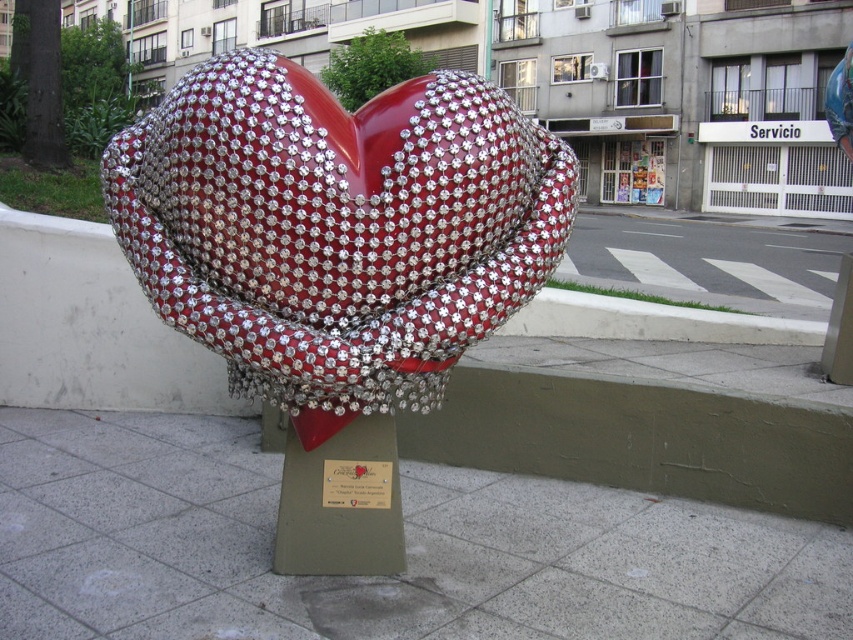
You are an art student analyzing the sculpture. You notice both the shiny metallic heart at center and the metallic plaque at center. Which object is taller?

The shiny metallic heart at center is taller than the metallic plaque at center.

Looking at this image, you are a delivery person with a cart that is 4 feet wide. You need to move from the white tile pavement at center to the green concrete curb at center. Is there enough space between them for your cart to pass through?

The distance between the white tile pavement at center and the green concrete curb at center is 5.35 feet. Since your cart is 4 feet wide, there is sufficient space for it to pass through as 5.35 feet is greater than 4 feet.